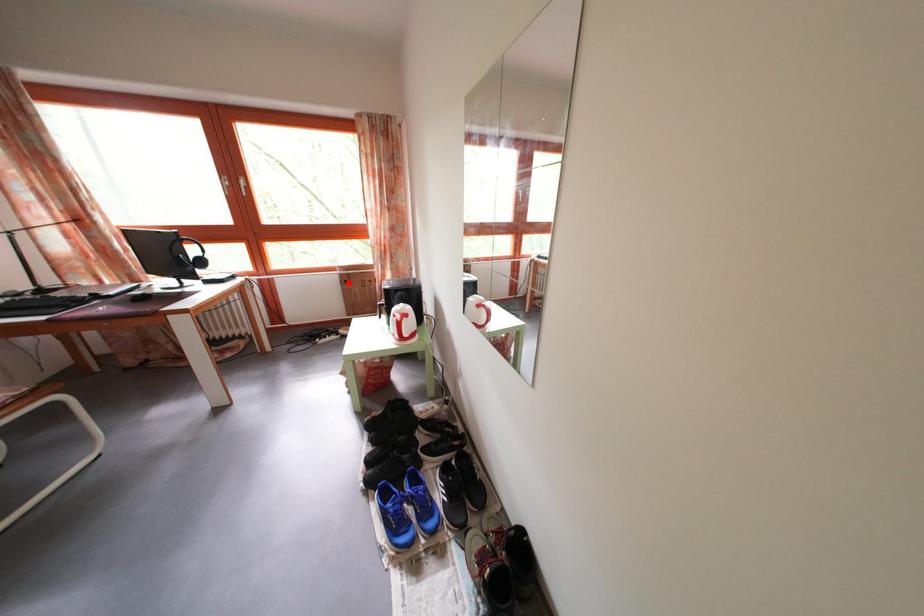
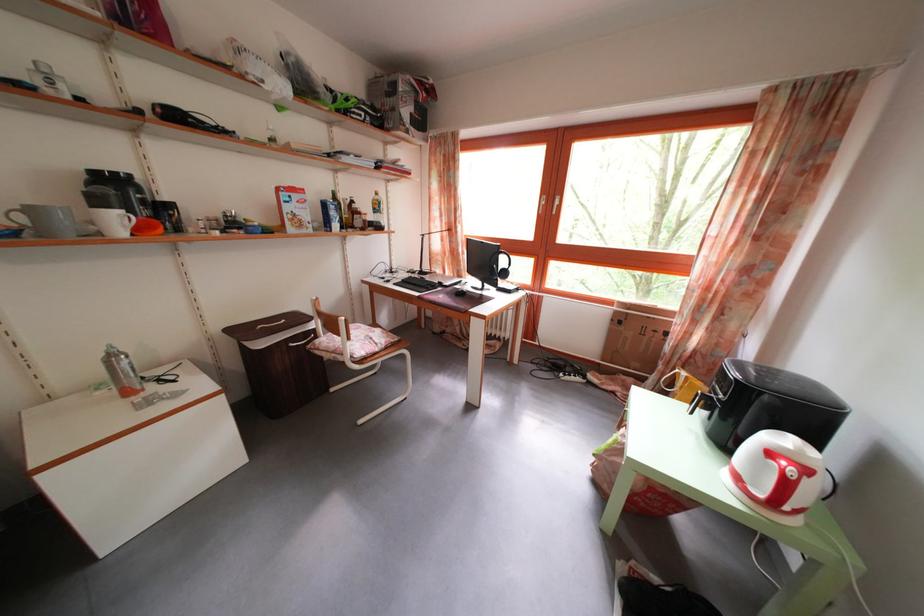
The point at the highlighted location is marked in the first image. Where is the corresponding point in the second image?

(623, 320)